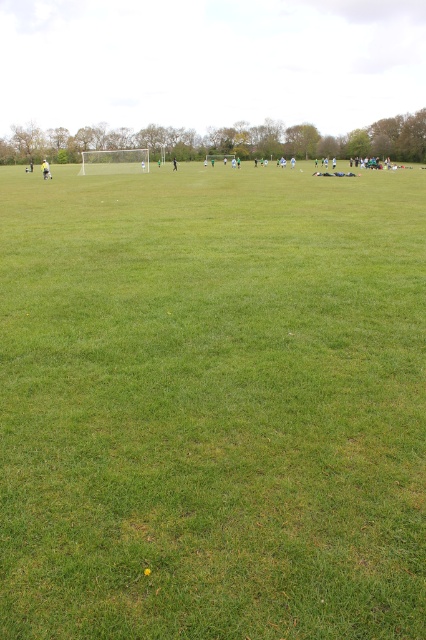
You are standing at point (x=46, y=170) in the field. What object is located exactly at your current position?

A light brown leather jacket at left is located exactly at point (x=46, y=170).

You are a drone operator trying to capture a photo of the light brown leather jacket at left and the black fabric person at center. The minimum distance your drone can focus on two objects is 90 feet. Can your drone capture both objects in focus at the same time?

The light brown leather jacket at left is 91.47 feet from the black fabric person at center, so the distance between them is slightly over the minimum focus distance of 90 feet. Therefore, the drone cannot capture both objects in focus simultaneously.